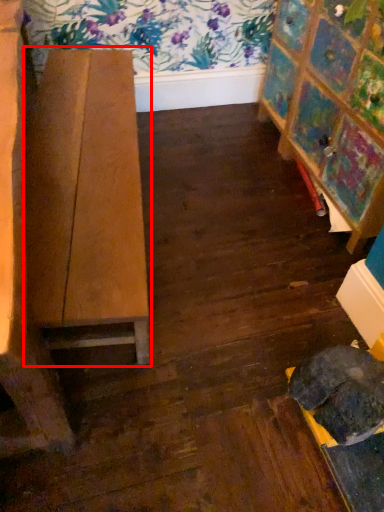
Question: From the image's perspective, where is table (annotated by the red box) located in relation to furniture in the image?

Choices:
 (A) above
 (B) below

Answer: (B)